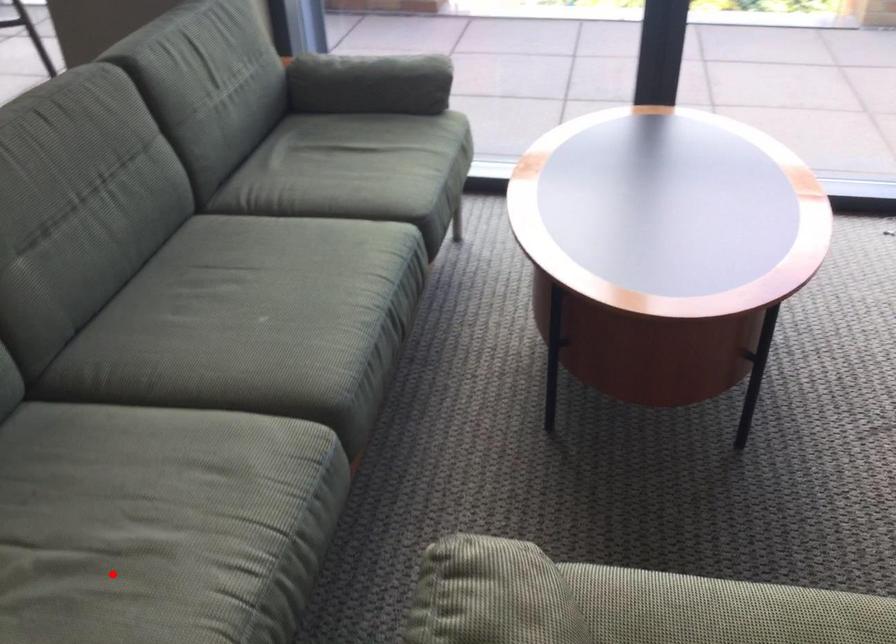
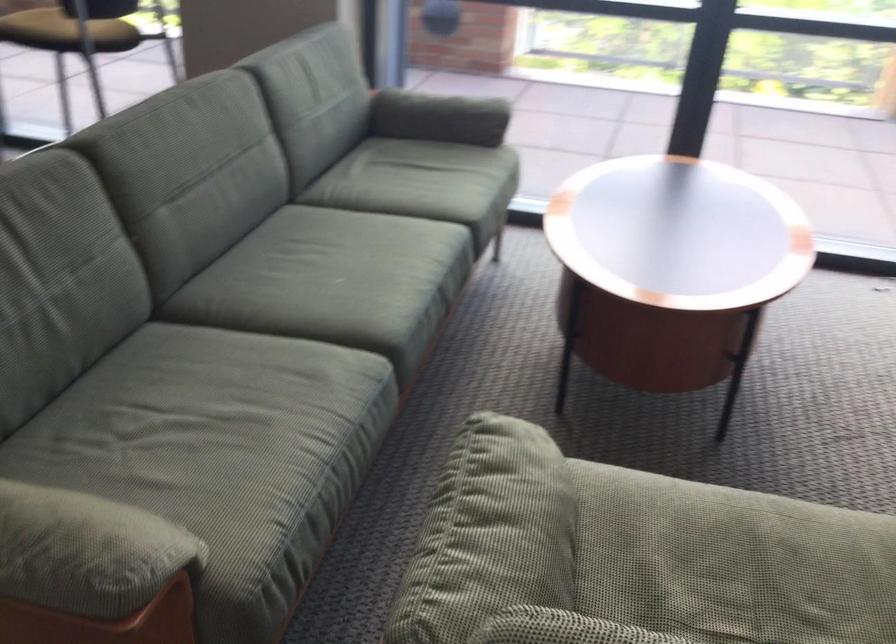
Question: I am providing you with two images of the same scene from different viewpoints. Given a red point in image1, look at the same physical point in image2. Is it:

Choices:
 (A) Closer to the viewpoint
 (B) Farther from the viewpoint

Answer: (B)